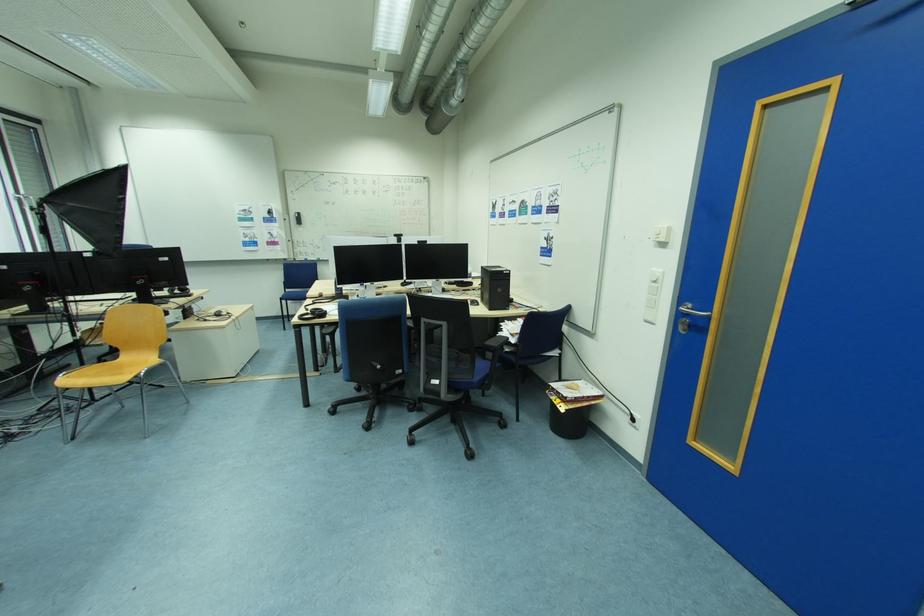
What do you see at coordinates (688, 315) in the screenshot? I see `a silver door handle` at bounding box center [688, 315].